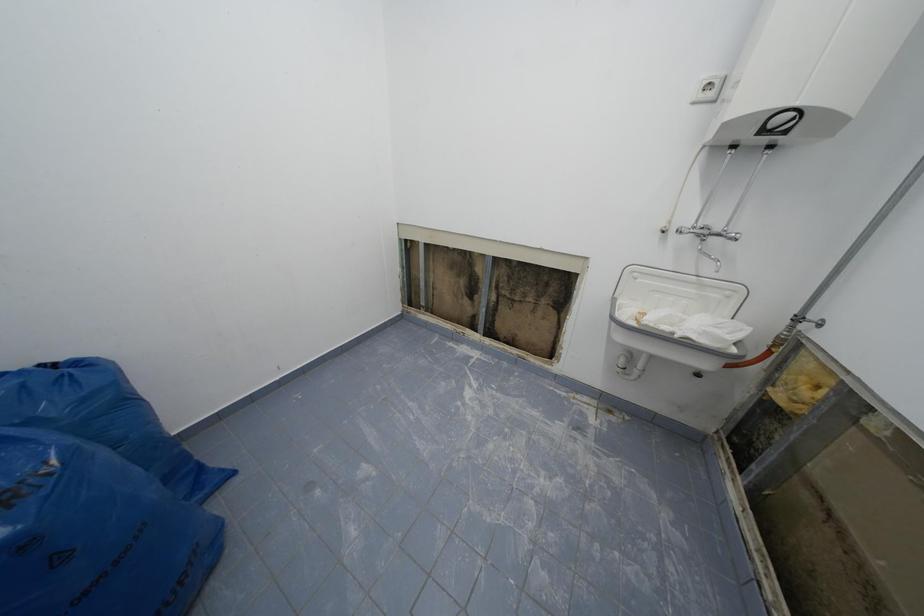
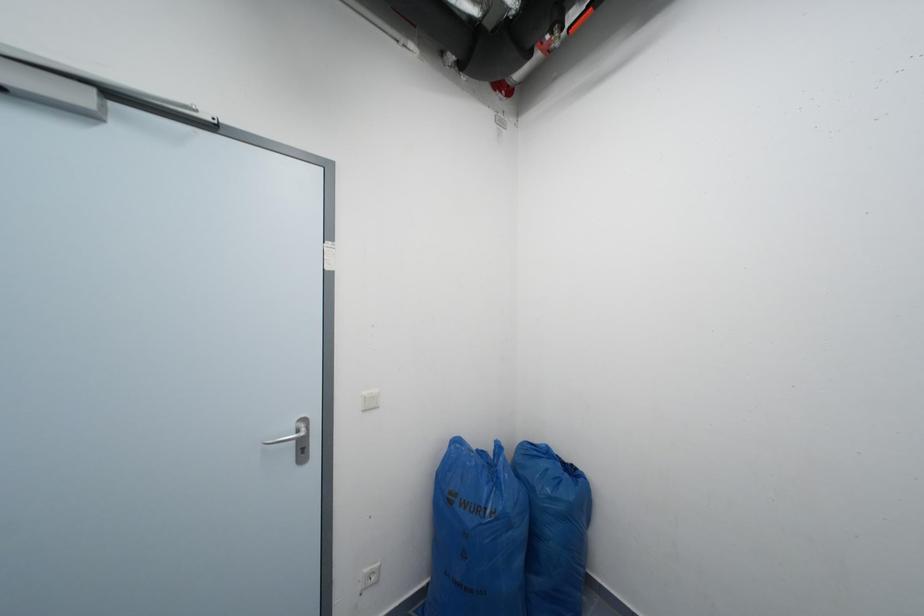
Question: Based on the continuous images, in which direction is the camera rotating? Reply with the corresponding letter.

Choices:
 (A) Left
 (B) Right
 (C) Up
 (D) Down

Answer: (A)